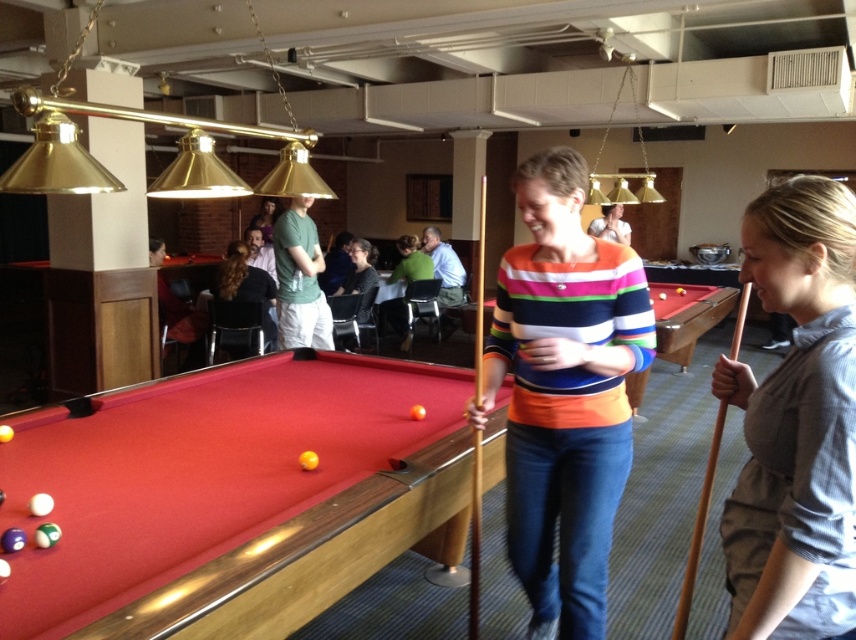
Who is taller, gray cotton shirt at center or wooden cue stick at center?

With more height is wooden cue stick at center.

Can you confirm if gray cotton shirt at center is thinner than wooden cue stick at center?

No, gray cotton shirt at center is not thinner than wooden cue stick at center.

Does point (762, 394) come closer to viewer compared to point (477, 337)?

That is True.

Where is `gray cotton shirt at center`? gray cotton shirt at center is located at coordinates (795, 422).

Is the position of striped cotton sweater at center less distant than that of wooden at right?

No, it is not.

Which is behind, point (520, 472) or point (706, 493)?

Point (520, 472)

Where is `striped cotton sweater at center`? This screenshot has height=640, width=856. striped cotton sweater at center is located at coordinates (563, 394).

Can you confirm if wooden at right is taller than striped sweater at center?

Yes, wooden at right is taller than striped sweater at center.

Does wooden at right appear on the left side of striped sweater at center?

Indeed, wooden at right is positioned on the left side of striped sweater at center.

Is point (685, 612) farther from camera compared to point (619, 211)?

No, it is not.

Locate an element on the screen. Image resolution: width=856 pixels, height=640 pixels. wooden at right is located at coordinates (698, 529).